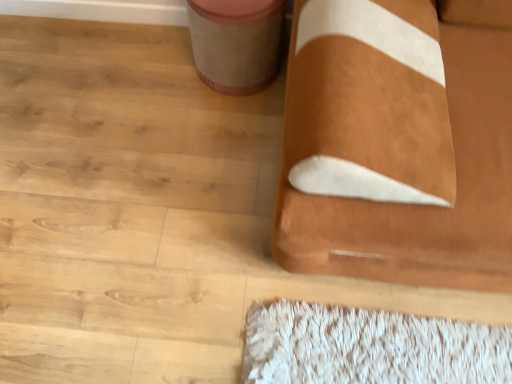
Question: Considering the positions of brown suede pillow at center and matte beige potty at upper center in the image, is brown suede pillow at center bigger or smaller than matte beige potty at upper center?

Choices:
 (A) small
 (B) big

Answer: (B)

Question: Is brown suede pillow at center inside the boundaries of matte beige potty at upper center, or outside?

Choices:
 (A) outside
 (B) inside

Answer: (A)

Question: From a real-world perspective, relative to matte beige potty at upper center, is brown suede pillow at center vertically above or below?

Choices:
 (A) below
 (B) above

Answer: (B)

Question: Looking at their shapes, would you say matte beige potty at upper center is wider or thinner than brown suede pillow at center?

Choices:
 (A) thin
 (B) wide

Answer: (A)

Question: From the image's perspective, is matte beige potty at upper center above or below brown suede pillow at center?

Choices:
 (A) above
 (B) below

Answer: (A)

Question: In terms of size, does matte beige potty at upper center appear bigger or smaller than brown suede pillow at center?

Choices:
 (A) small
 (B) big

Answer: (A)

Question: In the image, is matte beige potty at upper center on the left side or the right side of brown suede pillow at center?

Choices:
 (A) left
 (B) right

Answer: (A)